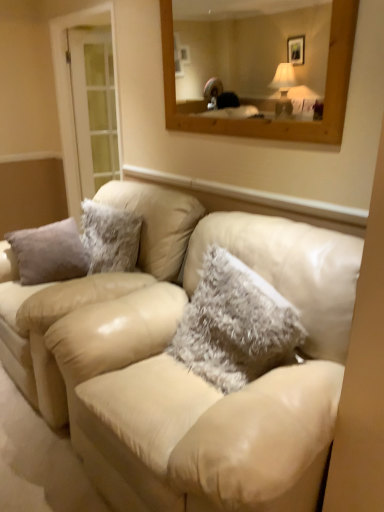
The height and width of the screenshot is (512, 384). Describe the element at coordinates (71, 94) in the screenshot. I see `clear glass door at left` at that location.

Describe the element at coordinates (235, 325) in the screenshot. The image size is (384, 512). I see `fuzzy white pillow at center` at that location.

Where is `clear glass door at left`? clear glass door at left is located at coordinates (71, 94).

Looking at this image, is fuzzy white pillow at center located within beige leather couch at center?

No, fuzzy white pillow at center is not a part of beige leather couch at center.

Which of these two, beige leather couch at center or fuzzy white pillow at center, stands shorter?

fuzzy white pillow at center.

Considering the positions of objects beige leather couch at center and fuzzy white pillow at center in the image provided, who is more to the right, beige leather couch at center or fuzzy white pillow at center?

Positioned to the right is fuzzy white pillow at center.

Is beige leather couch at center facing towards fuzzy white pillow at center?

No.

I want to click on studio couch in front of the fuzzy white pillow at center, so click(x=185, y=368).

Considering the sizes of objects fuzzy white pillow at center and beige leather couch at center in the image provided, who is wider, fuzzy white pillow at center or beige leather couch at center?

beige leather couch at center.

Is fuzzy white pillow at center not inside beige leather couch at center?

No, fuzzy white pillow at center is not entirely external to beige leather couch at center.

From the image's perspective, who appears lower, fuzzy white pillow at center or beige leather couch at center?

From the image's view, beige leather couch at center is below.

Between clear glass door at left and beige leather couch at center, which one appears on the left side from the viewer's perspective?

Positioned to the left is clear glass door at left.

Considering the sizes of objects clear glass door at left and beige leather couch at center in the image provided, who is wider, clear glass door at left or beige leather couch at center?

beige leather couch at center is wider.

Who is taller, clear glass door at left or beige leather couch at center?

Standing taller between the two is clear glass door at left.

Which is more to the right, clear glass door at left or beige leather couch at center?

beige leather couch at center is more to the right.

From the image's perspective, who appears lower, clear glass door at left or beige leather couch at center?

beige leather couch at center appears lower in the image.

Between clear glass door at left and beige leather couch at center, which one has smaller width?

Thinner between the two is clear glass door at left.

Considering the positions of points (71, 27) and (180, 400), is point (71, 27) closer to camera compared to point (180, 400)?

That is False.

Can you tell me how much fuzzy white pillow at center and beige leather couch at center differ in facing direction?

10.6 degrees.

Considering the sizes of fuzzy white pillow at center and beige leather couch at center in the image, is fuzzy white pillow at center bigger or smaller than beige leather couch at center?

fuzzy white pillow at center is smaller than beige leather couch at center.

Is the surface of fuzzy white pillow at center in direct contact with beige leather couch at center?

No, fuzzy white pillow at center is not next to beige leather couch at center.

Can you confirm if fuzzy white pillow at center is thinner than beige leather couch at center?

Correct, the width of fuzzy white pillow at center is less than that of beige leather couch at center.

From a real-world perspective, is fuzzy white pillow at center positioned over clear glass door at left based on gravity?

Incorrect, from a real-world perspective, fuzzy white pillow at center is lower than clear glass door at left.

How many degrees apart are the facing directions of fuzzy white pillow at center and clear glass door at left?

10.7 degrees.

Would you say clear glass door at left is part of fuzzy white pillow at center's contents?

No, fuzzy white pillow at center does not contain clear glass door at left.

Does beige leather couch at center have a smaller size compared to clear glass door at left?

No, beige leather couch at center is not smaller than clear glass door at left.

Is the position of beige leather couch at center more distant than that of clear glass door at left?

No, the depth of beige leather couch at center is less than that of clear glass door at left.

Visually, is beige leather couch at center positioned to the left or to the right of clear glass door at left?

Clearly, beige leather couch at center is on the right of clear glass door at left in the image.

This screenshot has height=512, width=384. I want to click on couch on the left of fuzzy white pillow at center, so click(x=100, y=306).

The width and height of the screenshot is (384, 512). Find the location of `pillow that appears above the beige leather couch at center (from the image's perspective)`. pillow that appears above the beige leather couch at center (from the image's perspective) is located at coordinates 235,325.

Estimate the real-world distances between objects in this image. Which object is further from beige leather couch at center, fuzzy white pillow at center or clear glass door at left?

clear glass door at left.

Estimate the real-world distances between objects in this image. Which object is closer to beige leather couch at center, fuzzy white pillow at center or clear glass door at left?

fuzzy white pillow at center is positioned closer to the anchor beige leather couch at center.

From the image, which object appears to be farther from beige leather couch at center, fuzzy white pillow at center or beige leather couch at center?

Based on the image, fuzzy white pillow at center appears to be further to beige leather couch at center.

Looking at this image, when comparing their distances from fuzzy white pillow at center, does beige leather couch at center or beige leather couch at center seem further?

beige leather couch at center lies further to fuzzy white pillow at center than the other object.

From the image, which object appears to be farther from beige leather couch at center, clear glass door at left or beige leather couch at center?

Among the two, clear glass door at left is located further to beige leather couch at center.

Based on the photo, looking at the image, which one is located further to clear glass door at left, fuzzy white pillow at center or beige leather couch at center?

fuzzy white pillow at center is further to clear glass door at left.

Looking at the image, which one is located further to fuzzy white pillow at center, beige leather couch at center or beige leather couch at center?

beige leather couch at center lies further to fuzzy white pillow at center than the other object.

In the scene shown: When comparing their distances from beige leather couch at center, does beige leather couch at center or clear glass door at left seem further?

Among the two, clear glass door at left is located further to beige leather couch at center.

Where is `couch between fuzzy white pillow at center and clear glass door at left along the z-axis`? The height and width of the screenshot is (512, 384). couch between fuzzy white pillow at center and clear glass door at left along the z-axis is located at coordinates (100, 306).

I want to click on pillow located between beige leather couch at center and clear glass door at left in the depth direction, so click(x=235, y=325).

The width and height of the screenshot is (384, 512). In order to click on studio couch located between beige leather couch at center and fuzzy white pillow at center in the left-right direction in this screenshot , I will do `click(185, 368)`.

Find the location of a particular element. The width and height of the screenshot is (384, 512). couch positioned between beige leather couch at center and clear glass door at left from near to far is located at coordinates (100, 306).